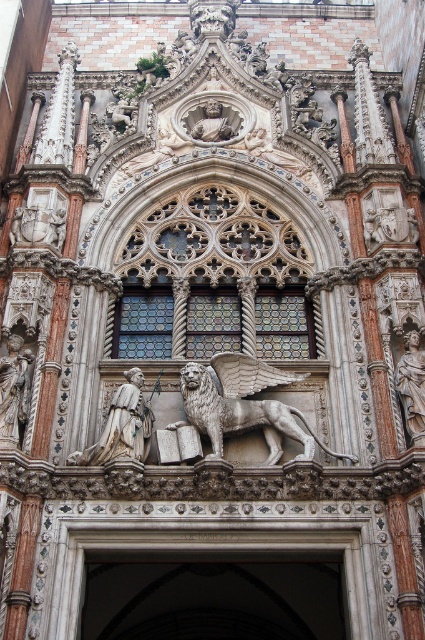
Question: Which of the following is the farthest from the observer?

Choices:
 (A) (119, 406)
 (B) (365, 618)
 (C) (277, 433)
 (D) (402, 403)

Answer: (C)

Question: Which point is farther to the camera?

Choices:
 (A) [405, 337]
 (B) [51, 620]
 (C) [144, 404]

Answer: (A)

Question: Which point is closer to the camera?

Choices:
 (A) (136, 429)
 (B) (272, 403)
 (C) (161, 528)

Answer: (C)

Question: Is polished stone lion at center smaller than silver metallic statue at left?

Choices:
 (A) no
 (B) yes

Answer: (A)

Question: Does polished stone lion at center appear over silver metallic statue at left?

Choices:
 (A) no
 (B) yes

Answer: (A)

Question: Does white stone arch at center appear over polished stone lion at center?

Choices:
 (A) no
 (B) yes

Answer: (A)